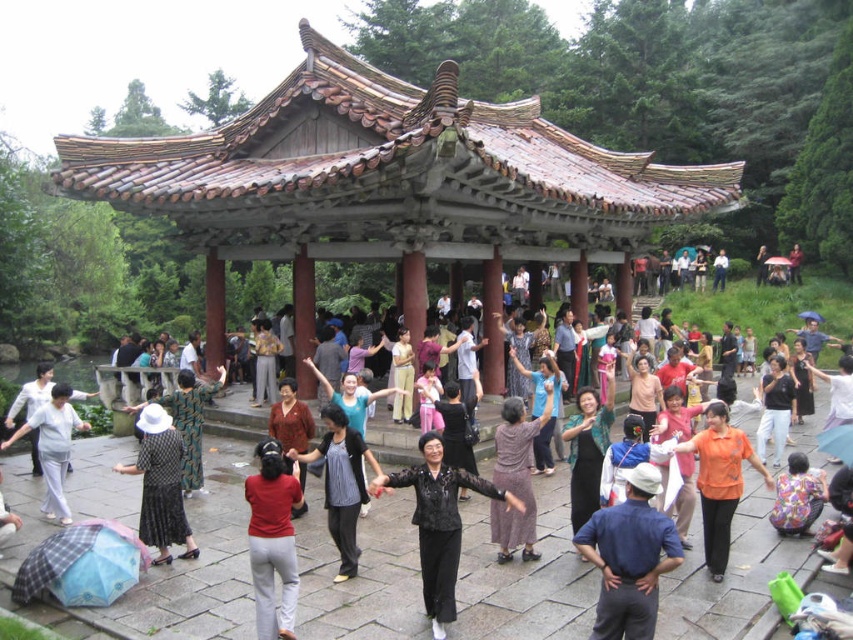
Question: Estimate the real-world distances between objects in this image. Which object is farther from the black matte pants at center?

Choices:
 (A) rusty metal gazebo at center
 (B) blue cotton shirt at center

Answer: (A)

Question: Can you confirm if blue cotton shirt at center is wider than black matte pants at center?

Choices:
 (A) no
 (B) yes

Answer: (B)

Question: Is rusty metal gazebo at center further to camera compared to blue cotton shirt at center?

Choices:
 (A) no
 (B) yes

Answer: (B)

Question: Based on their relative distances, which object is nearer to the black matte pants at center?

Choices:
 (A) rusty metal gazebo at center
 (B) blue cotton shirt at center

Answer: (B)

Question: Can you confirm if rusty metal gazebo at center is positioned above blue cotton shirt at center?

Choices:
 (A) yes
 (B) no

Answer: (A)

Question: Among these points, which one is farthest from the camera?

Choices:
 (A) (653, 627)
 (B) (619, 221)

Answer: (B)